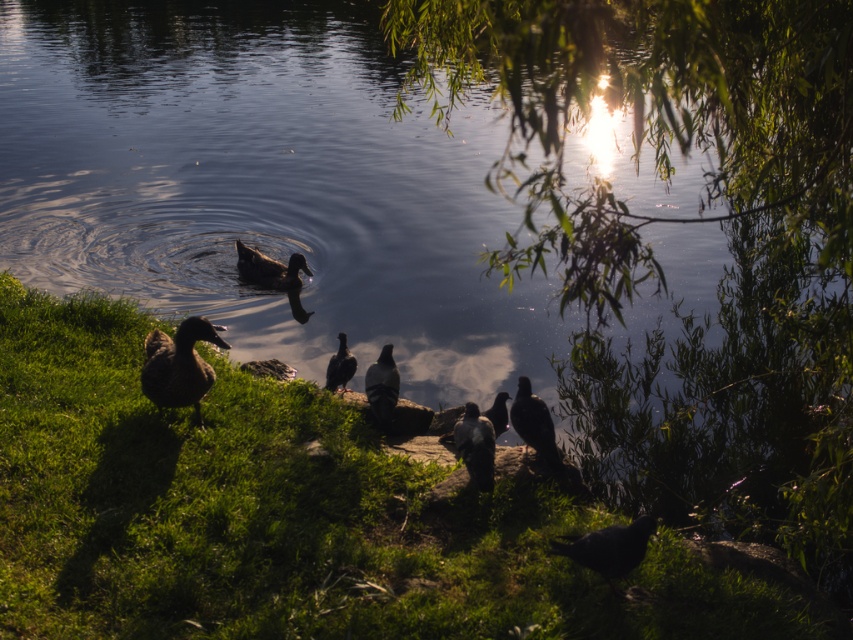
You are a birdwatcher trying to identify birds based on their size. You see a shiny black pigeon at center and a brown matte bird at lower left. Which bird is smaller in width?

The shiny black pigeon at center is smaller in width than the brown matte bird at lower left.

You are a photographer trying to capture the dark brown feathered duck at lower left and the silvery metallic pigeon at center in a single shot. Based on their positions, will the duck appear closer to the top or bottom of the photo?

The dark brown feathered duck at lower left is located above the silvery metallic pigeon at center, so it will appear closer to the top of the photo.